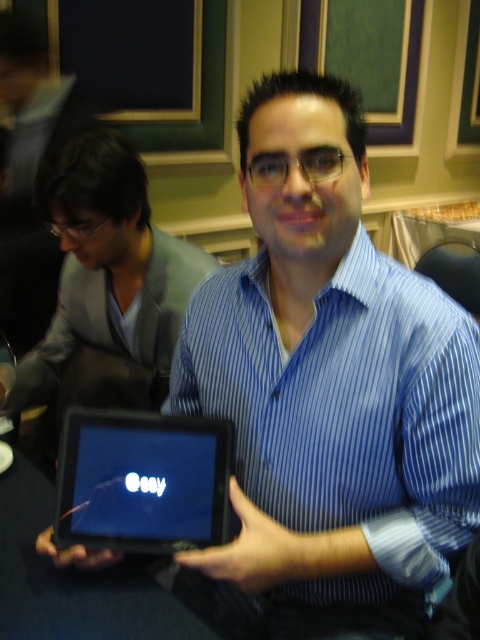
Question: Which point appears farthest from the camera in this image?

Choices:
 (A) (163, 515)
 (B) (56, 216)

Answer: (B)

Question: Can you confirm if matte gray suit at left is thinner than black matte tablet at center?

Choices:
 (A) yes
 (B) no

Answer: (B)

Question: Which point is closer to the camera taking this photo?

Choices:
 (A) (66, 166)
 (B) (129, 502)

Answer: (B)

Question: Is matte gray suit at left to the left of black matte tablet at center from the viewer's perspective?

Choices:
 (A) no
 (B) yes

Answer: (B)

Question: Is matte gray suit at left further to camera compared to black matte tablet at center?

Choices:
 (A) no
 (B) yes

Answer: (B)